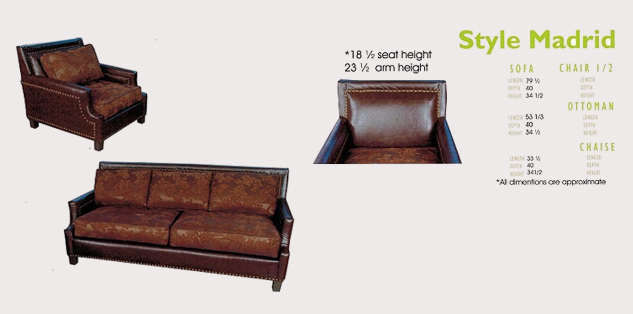
Find the location of a particular element. The height and width of the screenshot is (314, 633). left couch arm is located at coordinates (287, 215).